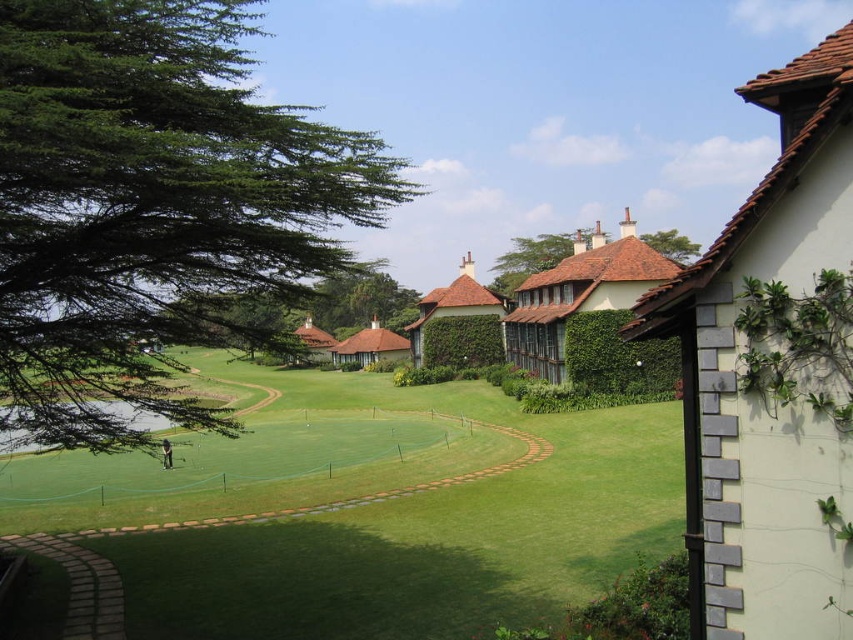
Question: Which point appears closest to the camera in this image?

Choices:
 (A) (581, 376)
 (B) (328, 282)

Answer: (A)

Question: Where is green grass at center located in relation to brown shingles roof at upper center in the image?

Choices:
 (A) left
 (B) right

Answer: (A)

Question: Is green grass at center thinner than green leafy hedge at center?

Choices:
 (A) no
 (B) yes

Answer: (A)

Question: Does green leafy tree at left appear on the left side of green leafy hedge at center?

Choices:
 (A) yes
 (B) no

Answer: (A)

Question: Which point appears closest to the camera in this image?

Choices:
 (A) (608, 384)
 (B) (148, 204)
 (C) (682, 240)

Answer: (B)

Question: Which object is the farthest from the green leafy hedge at center-right?

Choices:
 (A) green leafy hedge at center
 (B) green grass at center

Answer: (A)